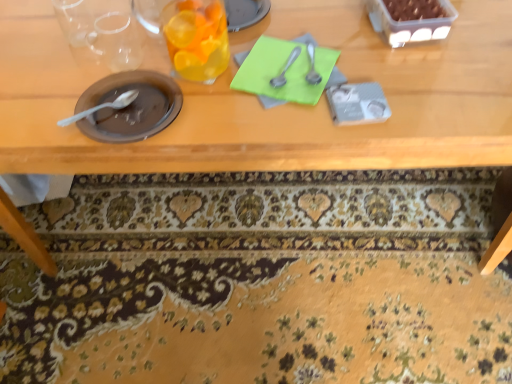
You are a GUI agent. You are given a task and a screenshot of the screen. Output one action in this format:
    pyautogui.click(x=<x>, y=<y>)
    Task: Click on the free space behind satin silver spoon at upper center, the 4th tableware when ordered from left to right
    The width and height of the screenshot is (512, 384).
    Given the screenshot: What is the action you would take?
    pyautogui.click(x=304, y=24)